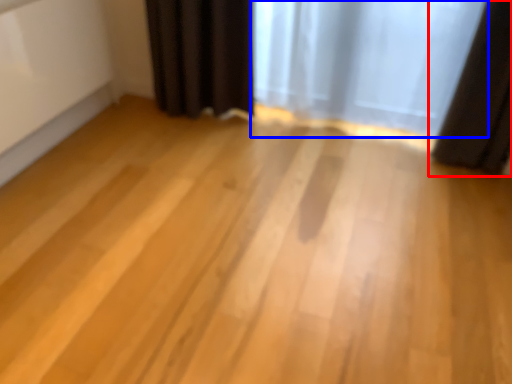
Question: Which point is further to the camera, curtain (highlighted by a red box) or curtain (highlighted by a blue box)?

Choices:
 (A) curtain
 (B) curtain

Answer: (B)